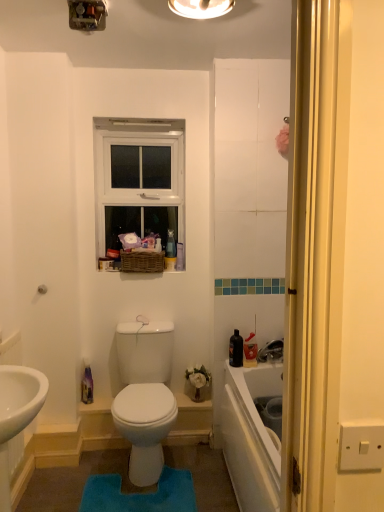
Question: Considering their positions, is blue plush bath mat at center located in front of or behind metallic switchplate at upper center, which is the 2th light fixture in right-to-left order?

Choices:
 (A) behind
 (B) front

Answer: (A)

Question: Is point (188, 483) closer or farther from the camera than point (91, 9)?

Choices:
 (A) closer
 (B) farther

Answer: (B)

Question: Considering the real-world distances, which object is farthest from the matte white light fixture at upper center, arranged as the first light fixture when viewed from the right?

Choices:
 (A) white plastic window at upper center
 (B) metallic switchplate at upper center, which is the 2th light fixture in right-to-left order
 (C) blue plush bath mat at center

Answer: (C)

Question: Which object is the farthest from the metallic switchplate at upper center, which appears as the first light fixture when viewed from the left?

Choices:
 (A) matte white light fixture at upper center, arranged as the first light fixture when viewed from the right
 (B) white plastic window at upper center
 (C) blue plush bath mat at center

Answer: (C)